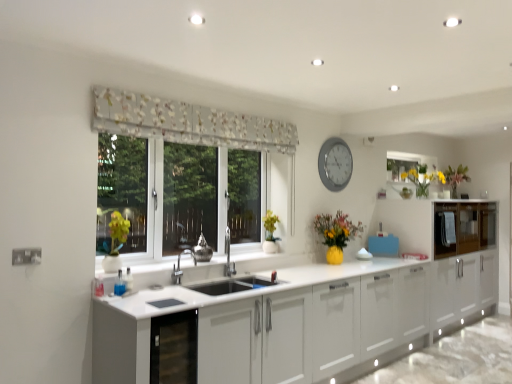
Identify the location of free point above silver metallic clock at upper center (from a real-world perspective). The width and height of the screenshot is (512, 384). (336, 137).